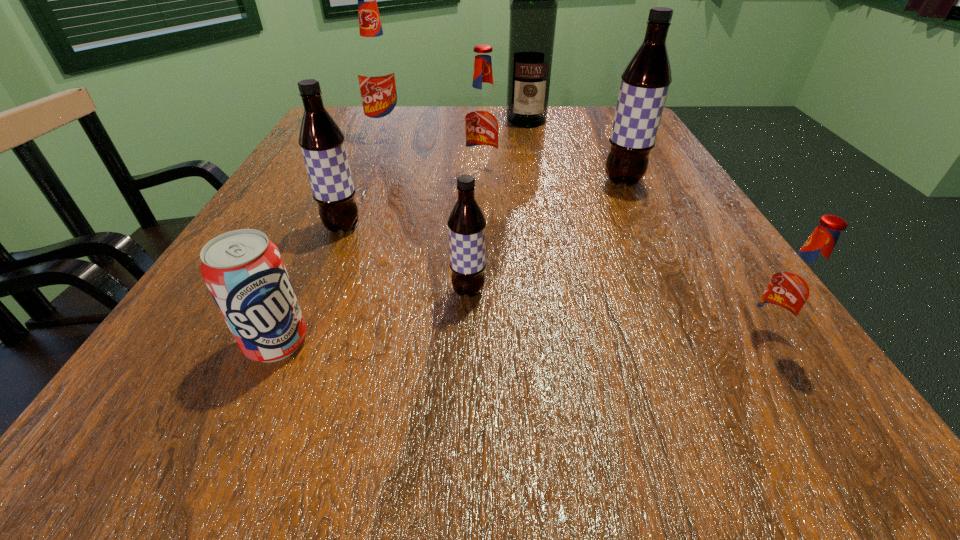
The width and height of the screenshot is (960, 540). I want to click on free location at the right edge, so click(660, 184).

Where is `free space at the far left corner of the desktop`? The image size is (960, 540). free space at the far left corner of the desktop is located at coordinates (341, 112).

I want to click on vacant area that lies between the biggest brown root beer and the soda can, so click(450, 262).

Locate an element on the screen. free area in between the rightmost root beer and the tallest object is located at coordinates [x=645, y=228].

This screenshot has height=540, width=960. Identify the location of empty space between the rightmost red root beer and the farthest object. (645, 228).

Where is `vacant point located between the smallest red root beer and the third nearest object`? vacant point located between the smallest red root beer and the third nearest object is located at coordinates (616, 314).

I want to click on free spot between the shortest object and the second nearest red root beer, so click(380, 258).

Image resolution: width=960 pixels, height=540 pixels. What are the coordinates of `unoccupied area between the alcohol and the soda can` in the screenshot? It's located at (401, 232).

Identify the location of free spot between the farthest brown root beer and the second smallest red root beer. (553, 178).

Locate an element on the screen. vacant point located between the alcohol and the second red root beer from right to left is located at coordinates (504, 147).